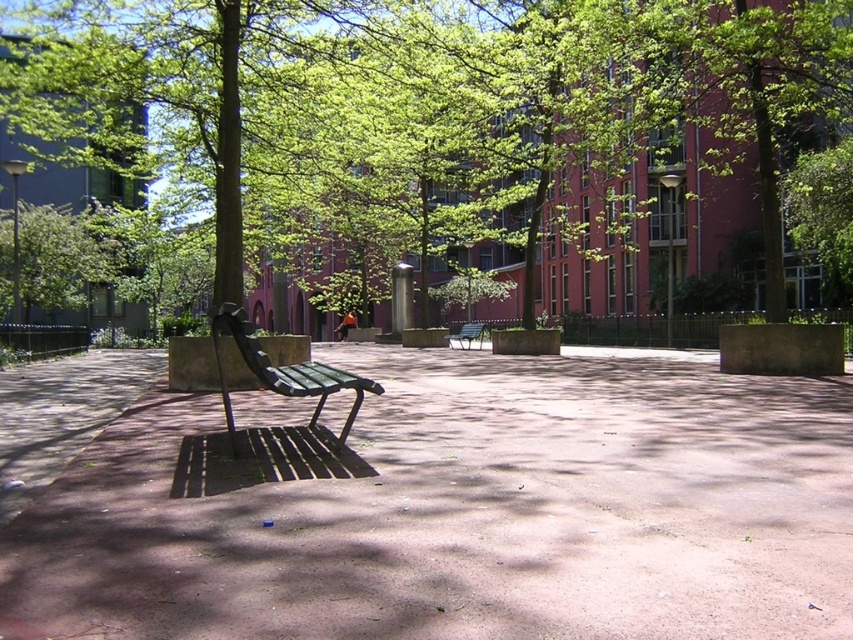
Question: From the image, what is the correct spatial relationship of brown concrete pavement at center in relation to green painted wood bench at center?

Choices:
 (A) below
 (B) above

Answer: (A)

Question: Considering the real-world distances, which object is closest to the brown concrete pavement at center?

Choices:
 (A) green painted wood bench at center
 (B) wooden bench at center
 (C) green leafy tree at center

Answer: (A)

Question: Estimate the real-world distances between objects in this image. Which object is farther from the green leafy tree at center?

Choices:
 (A) green painted wood bench at center
 (B) wooden bench at center

Answer: (A)

Question: Does brown concrete pavement at center have a lesser width compared to green painted wood bench at center?

Choices:
 (A) yes
 (B) no

Answer: (B)

Question: Which point is farther to the camera?

Choices:
 (A) wooden bench at center
 (B) brown concrete pavement at center
 (C) green leafy tree at center

Answer: (A)

Question: Is the position of green painted wood bench at center less distant than that of wooden bench at center?

Choices:
 (A) no
 (B) yes

Answer: (B)